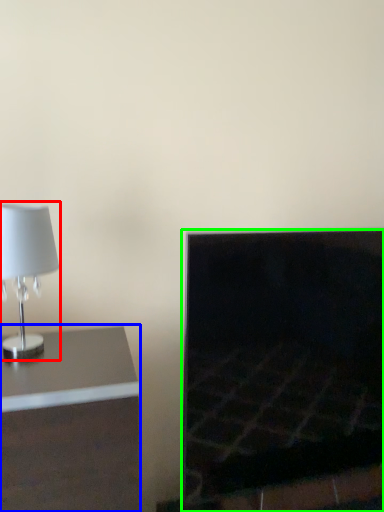
Question: Based on their relative distances, which object is nearer to lamp (highlighted by a red box)? Choose from furniture (highlighted by a blue box) and fireplace (highlighted by a green box).

Choices:
 (A) furniture
 (B) fireplace

Answer: (A)